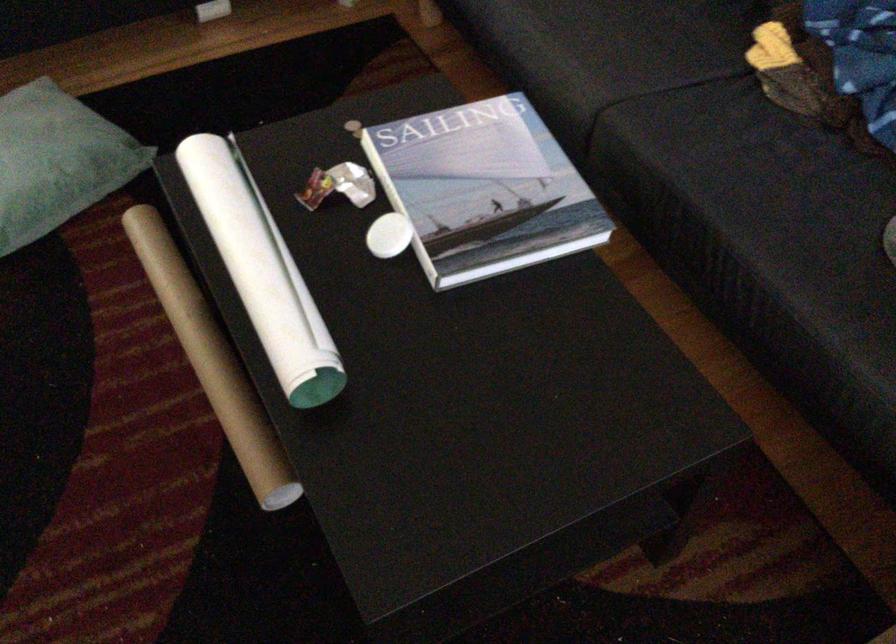
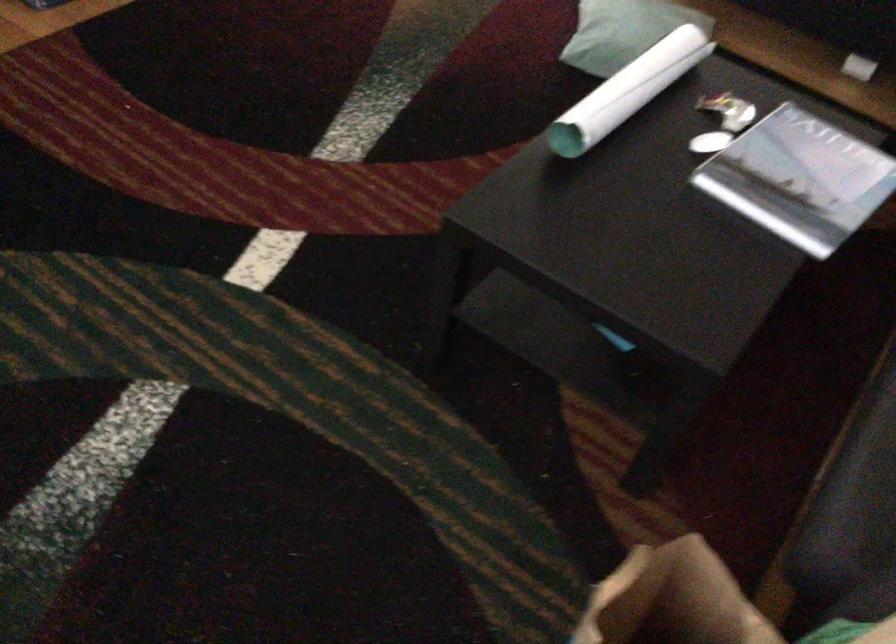
Question: I am providing you with two images of the same scene from different viewpoints. After the viewpoint changes to image2, which objects are now occluded?

Choices:
 (A) magazine on table
 (B) rolled up poster
 (C) cardboard tube
 (D) red and white marker

Answer: (C)